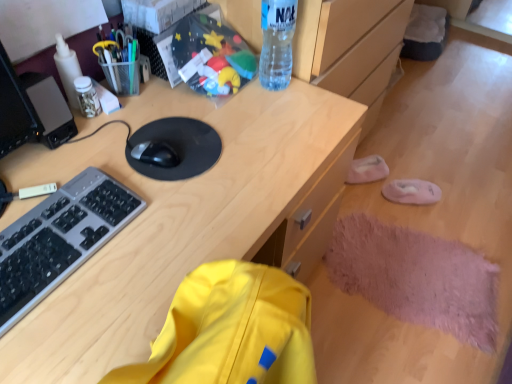
Find the location of a particular element. spots to the right of metallic pen holder at upper left, positioned as the first stationery in right-to-left order is located at coordinates (186, 100).